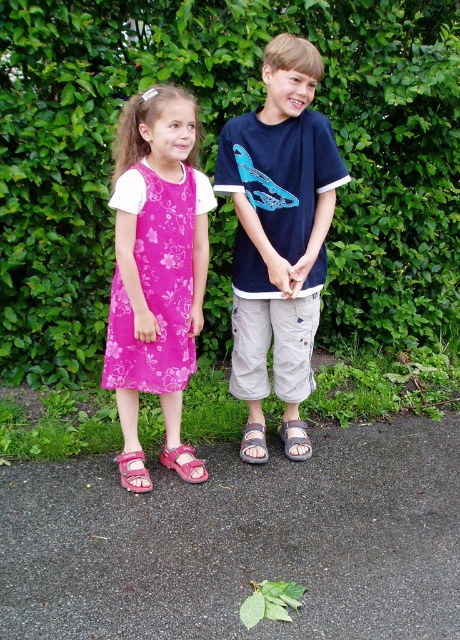
Based on the scene description, can you determine if the pink floral dress at left is covering the pink fabric sandal at lower left?

The pink floral dress at left is positioned over pink fabric sandal at lower left, so yes, the pink floral dress at left is covering the pink fabric sandal at lower left.